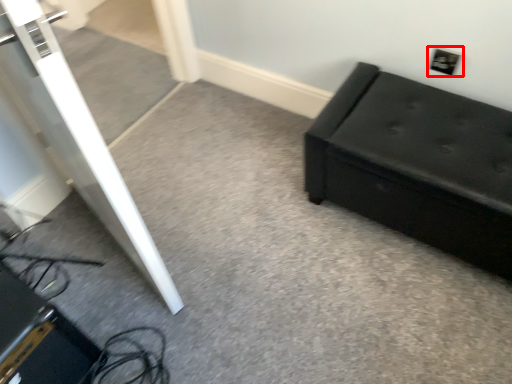
Question: From the image's perspective, considering the relative positions of electric outlet (annotated by the red box) and furniture in the image provided, where is electric outlet (annotated by the red box) located with respect to the staircase?

Choices:
 (A) below
 (B) above

Answer: (B)